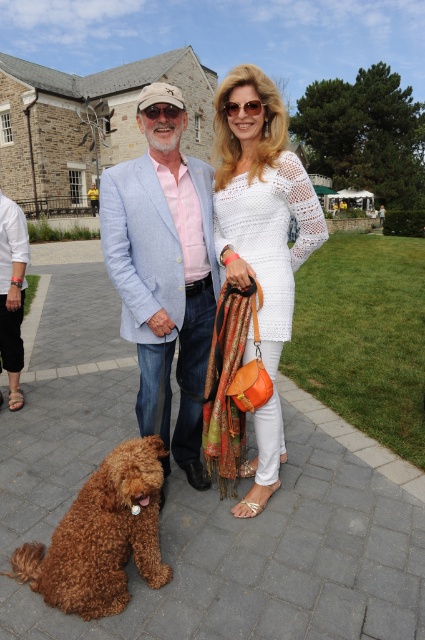
Who is shorter, light blue textured blazer at center or white crochet dress at center?

Standing shorter between the two is light blue textured blazer at center.

Can you confirm if light blue textured blazer at center is positioned above white crochet dress at center?

No, light blue textured blazer at center is not above white crochet dress at center.

Does point (158, 250) come behind point (277, 212)?

No, it is not.

You are a GUI agent. You are given a task and a screenshot of the screen. Output one action in this format:
    pyautogui.click(x=<x>, y=<y>)
    Task: Click on the light blue textured blazer at center
    
    Given the screenshot: What is the action you would take?
    pyautogui.click(x=161, y=253)

Can you confirm if white crochet dress at center is thinner than brown fluffy dog at lower left?

Yes.

Between white crochet dress at center and brown fluffy dog at lower left, which one has less height?

brown fluffy dog at lower left

Which is in front, point (278, 353) or point (82, 545)?

Point (82, 545)

This screenshot has width=425, height=640. In order to click on white crochet dress at center in this screenshot , I will do `click(260, 202)`.

Can you confirm if light blue textured blazer at center is shorter than brown fluffy dog at lower left?

No, light blue textured blazer at center is not shorter than brown fluffy dog at lower left.

Does light blue textured blazer at center appear on the right side of brown fluffy dog at lower left?

Yes, light blue textured blazer at center is to the right of brown fluffy dog at lower left.

Locate an element on the screen. light blue textured blazer at center is located at coordinates (161, 253).